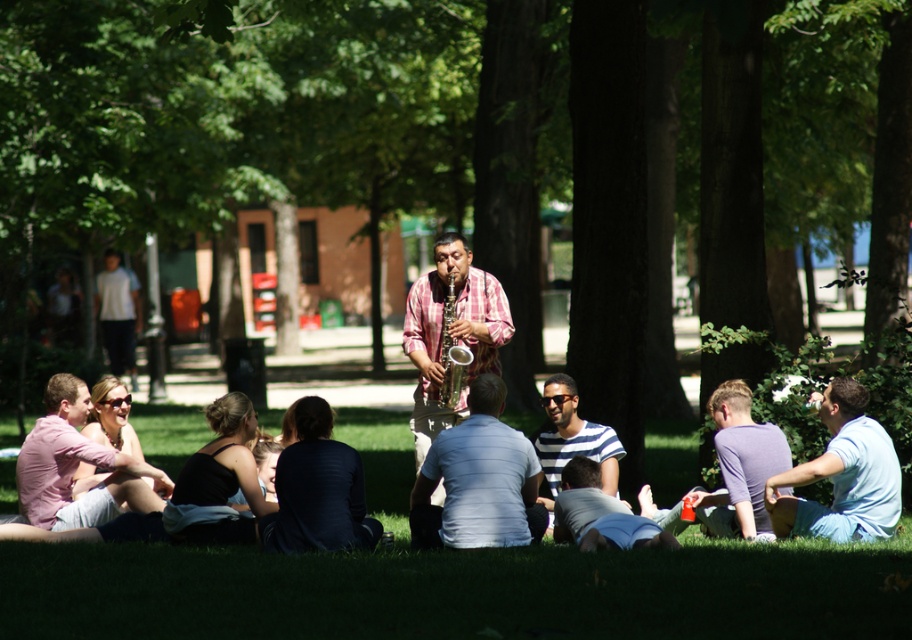
What object is located at the coordinates point (478, 481) in the image?

The point (478, 481) marks the light blue cotton shirt at center.

You are standing in the park and see the man in the red and white checkered shirt playing the saxophone. There is a point at coordinates (599, 515). What object is this point located on?

The point at coordinates (599, 515) is located on the light blue cotton shirt at lower center.